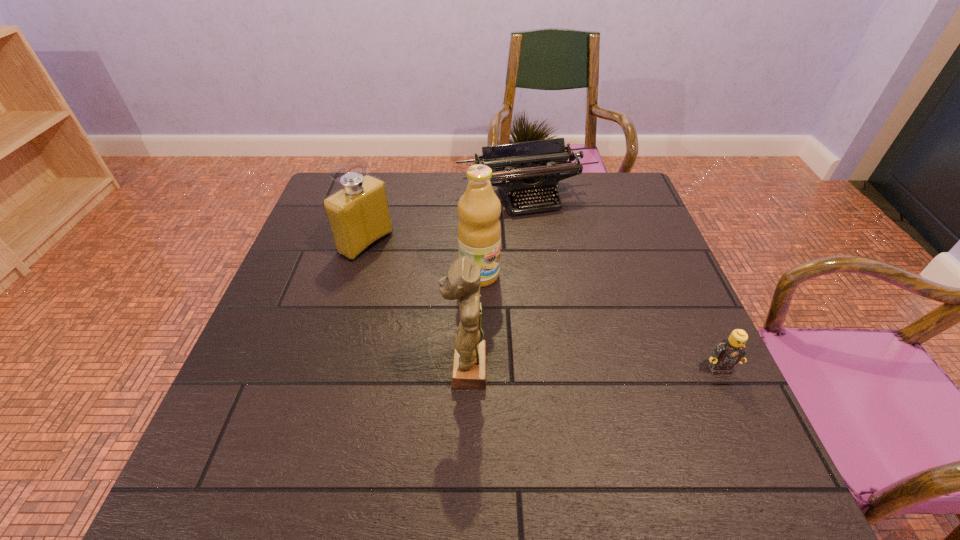
Where is `figurine`? The height and width of the screenshot is (540, 960). figurine is located at coordinates (462, 281).

Locate an element on the screen. The width and height of the screenshot is (960, 540). Lego is located at coordinates (729, 352).

This screenshot has width=960, height=540. What are the coordinates of `the rightmost object` in the screenshot? It's located at (729, 352).

This screenshot has height=540, width=960. I want to click on the second shortest object, so click(548, 159).

Locate an element on the screen. The height and width of the screenshot is (540, 960). the farthest object is located at coordinates (548, 159).

At what (x,y) coordinates should I click in order to perform the action: click on perfume. Please return your answer as a coordinate pair (x, y). This screenshot has height=540, width=960. Looking at the image, I should click on (358, 214).

This screenshot has height=540, width=960. I want to click on the leftmost object, so click(358, 214).

Where is `olive oil`? The height and width of the screenshot is (540, 960). olive oil is located at coordinates coord(479,230).

This screenshot has width=960, height=540. What are the coordinates of `vacant area located on the front-facing side of the figurine` in the screenshot? It's located at (317, 368).

You are a GUI agent. You are given a task and a screenshot of the screen. Output one action in this format:
    pyautogui.click(x=<x>, y=<y>)
    Task: Click on the free space located 0.280m on the front-facing side of the figurine
    The image size is (960, 540).
    Given the screenshot: What is the action you would take?
    pyautogui.click(x=312, y=368)